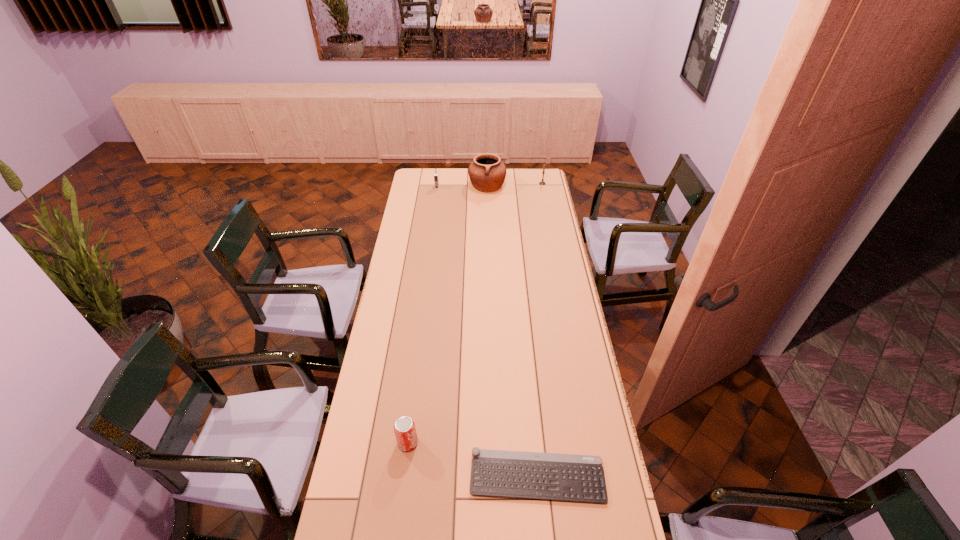
I want to click on free location that satisfies the following two spatial constraints: 1. on the front-facing side of the computer keyboard; 2. on the left side of the cellular telephone, so click(398, 477).

The image size is (960, 540). I want to click on vacant space that satisfies the following two spatial constraints: 1. on the front-facing side of the shortest object; 2. on the right side of the cellular telephone, so click(x=398, y=477).